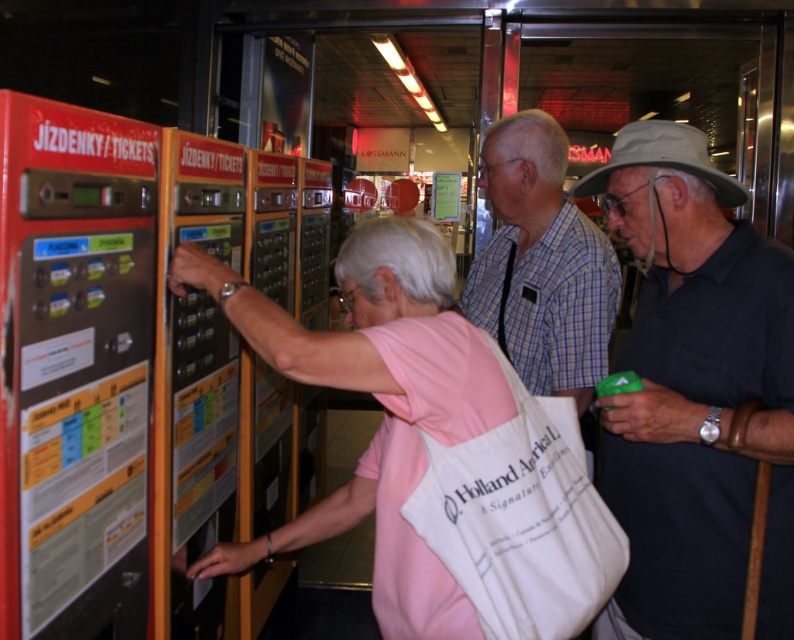
Is point (667, 188) positioned behind point (503, 264)?

No, it is not.

Is black fabric hat at upper right above plaid cotton shirt at center?

Incorrect, black fabric hat at upper right is not positioned above plaid cotton shirt at center.

Between point (692, 458) and point (511, 122), which one is positioned in front?

Positioned in front is point (692, 458).

You are a GUI agent. You are given a task and a screenshot of the screen. Output one action in this format:
    pyautogui.click(x=<x>, y=<y>)
    Task: Click on the black fabric hat at upper right
    This screenshot has height=640, width=794.
    Given the screenshot: What is the action you would take?
    pyautogui.click(x=696, y=394)

Does black fabric hat at upper right have a greater width compared to pink fabric bag at center?

In fact, black fabric hat at upper right might be narrower than pink fabric bag at center.

Between black fabric hat at upper right and pink fabric bag at center, which one appears on the right side from the viewer's perspective?

black fabric hat at upper right

Is point (727, 577) positioned in front of point (345, 502)?

Yes, point (727, 577) is closer to viewer.

Locate an element on the screen. This screenshot has width=794, height=640. black fabric hat at upper right is located at coordinates (696, 394).

Can you confirm if pink fabric bag at center is bigger than plaid cotton shirt at center?

Indeed, pink fabric bag at center has a larger size compared to plaid cotton shirt at center.

Which is more to the right, pink fabric bag at center or plaid cotton shirt at center?

From the viewer's perspective, plaid cotton shirt at center appears more on the right side.

The image size is (794, 640). What do you see at coordinates (378, 401) in the screenshot?
I see `pink fabric bag at center` at bounding box center [378, 401].

Image resolution: width=794 pixels, height=640 pixels. I want to click on pink fabric bag at center, so click(x=378, y=401).